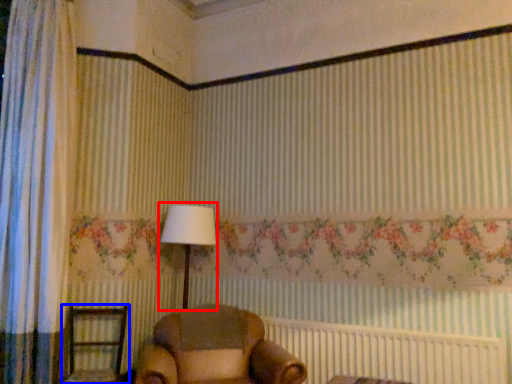
Question: Which point is closer to the camera, table lamp (highlighted by a red box) or furniture (highlighted by a blue box)?

Choices:
 (A) table lamp
 (B) furniture

Answer: (B)